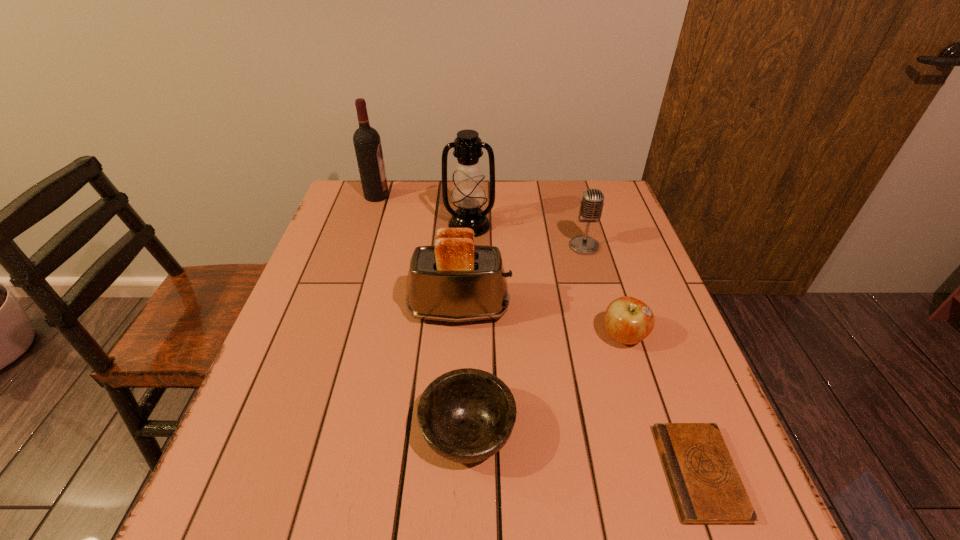
The width and height of the screenshot is (960, 540). I want to click on vacant space at the far left corner of the desktop, so click(391, 191).

In the image, there is a desktop. Where is `vacant space at the near left corner`? vacant space at the near left corner is located at coordinates (208, 499).

At what (x,y) coordinates should I click in order to perform the action: click on vacant area that lies between the diary and the bowl. Please return your answer as a coordinate pair (x, y). The width and height of the screenshot is (960, 540). Looking at the image, I should click on (584, 453).

Image resolution: width=960 pixels, height=540 pixels. In order to click on vacant area between the oil lamp and the bowl in this screenshot , I will do `click(468, 329)`.

This screenshot has height=540, width=960. In order to click on vacant area that lies between the oil lamp and the shortest object in this screenshot , I will do `click(585, 349)`.

I want to click on free spot between the leftmost object and the shortest object, so click(538, 334).

The height and width of the screenshot is (540, 960). I want to click on vacant region between the apple and the shortest object, so click(661, 404).

This screenshot has width=960, height=540. I want to click on unoccupied area between the diary and the microphone, so 641,360.

Find the location of `object that stands as the second closest to the wine bottle`. object that stands as the second closest to the wine bottle is located at coordinates (454, 280).

Locate which object ranks fourth in proximity to the oil lamp. Please provide its 2D coordinates. Your answer should be formatted as a tuple, i.e. [(x, y)], where the tuple contains the x and y coordinates of a point satisfying the conditions above.

[(628, 320)]